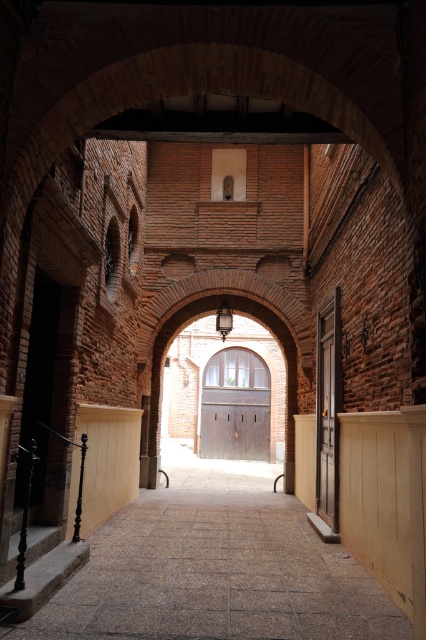
Is point (247, 499) farther from viewer compared to point (250, 413)?

No, it is in front of (250, 413).

In the scene shown: Can you confirm if smooth stone path at center is positioned to the right of brown wooden door at center?

In fact, smooth stone path at center is to the left of brown wooden door at center.

Which is in front, point (115, 604) or point (218, 436)?

Point (115, 604) is more forward.

The height and width of the screenshot is (640, 426). What are the coordinates of `smooth stone path at center` in the screenshot? It's located at (215, 568).

Does brick archway at center appear on the right side of brown wooden door at center?

No, brick archway at center is not to the right of brown wooden door at center.

Who is more distant from viewer, (239, 445) or (244, 454)?

The point (239, 445) is more distant.

Find the location of a particular element. brick archway at center is located at coordinates (233, 371).

Can you confirm if smooth stone path at center is shorter than brick archway at center?

Correct, smooth stone path at center is not as tall as brick archway at center.

Between point (227, 544) and point (241, 449), which one is positioned behind?

The point (241, 449) is more distant.

You are a GUI agent. You are given a task and a screenshot of the screen. Output one action in this format:
    pyautogui.click(x=<x>, y=<y>)
    Task: Click on the smooth stone path at center
    This screenshot has width=426, height=640.
    Given the screenshot: What is the action you would take?
    pyautogui.click(x=215, y=568)